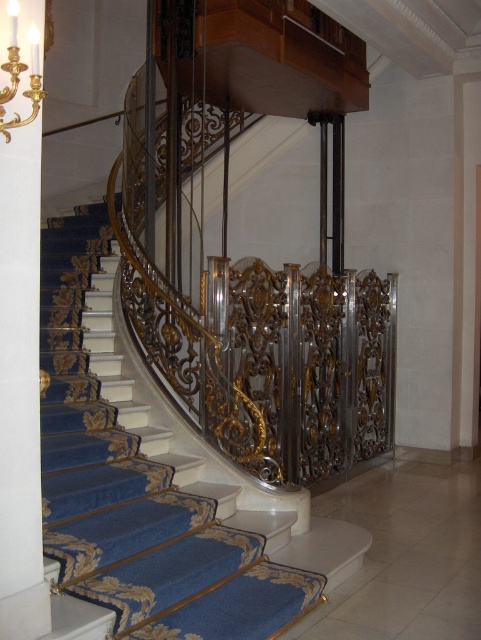
Who is higher up, white glossy pillar at left or gold metallic chandelier at upper left?

gold metallic chandelier at upper left is above.

Identify the location of white glossy pillar at left. (20, 321).

Find the location of a particular element. white glossy pillar at left is located at coordinates (20, 321).

Locate an element on the screen. Image resolution: width=481 pixels, height=640 pixels. white glossy pillar at left is located at coordinates (20, 321).

Describe the element at coordinates (138, 490) in the screenshot. I see `blue carpeted stairs at center` at that location.

Does point (85, 506) lie behind point (3, 92)?

Yes, it is behind point (3, 92).

At what (x,y) coordinates should I click in order to perform the action: click on blue carpeted stairs at center. Please return your answer as a coordinate pair (x, y). Looking at the image, I should click on (138, 490).

Between blue carpeted stairs at center and white glossy pillar at left, which one is positioned lower?

Positioned lower is blue carpeted stairs at center.

Can you confirm if blue carpeted stairs at center is wider than white glossy pillar at left?

Yes.

Who is more distant from viewer, (256, 541) or (35, 198)?

The point (256, 541) is more distant.

The height and width of the screenshot is (640, 481). What are the coordinates of `blue carpeted stairs at center` in the screenshot? It's located at (138, 490).